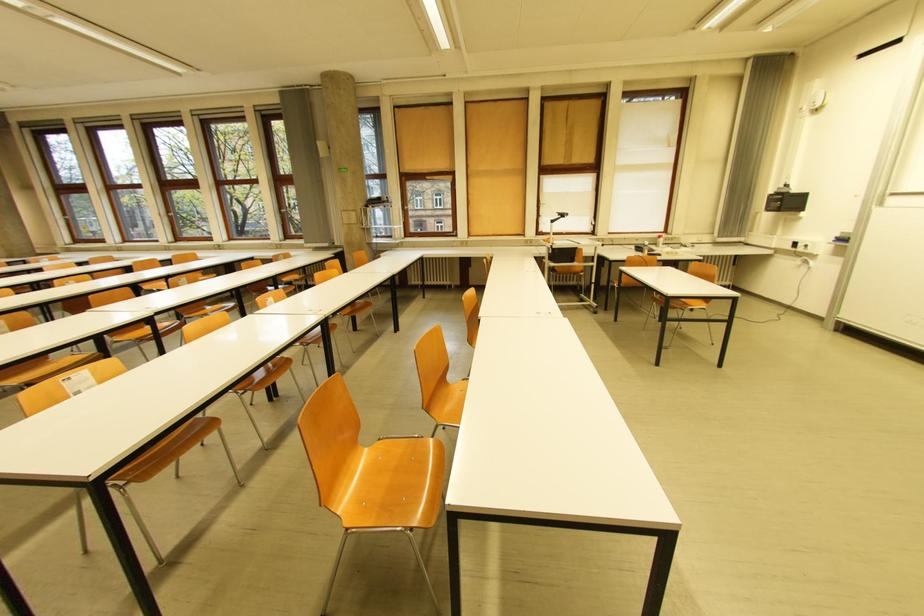
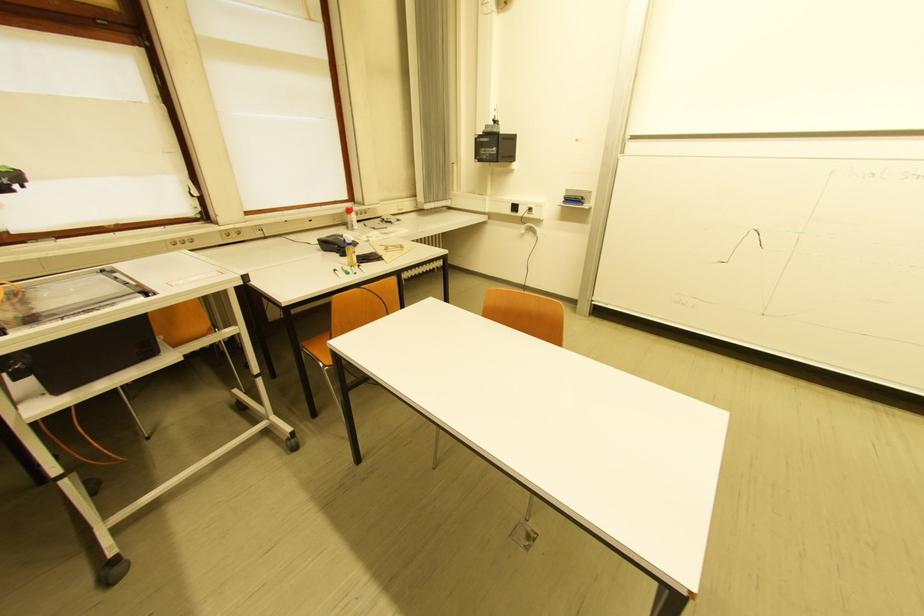
In the second image, find the point that corresponds to [643,252] in the first image.

(332, 252)